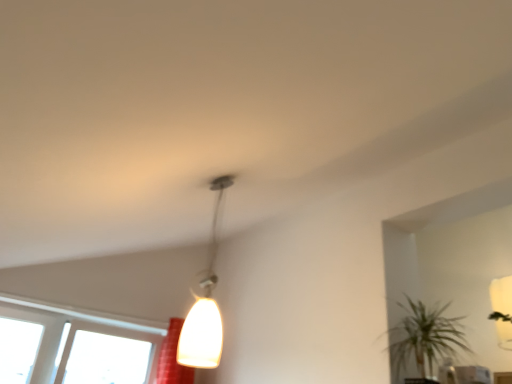
Question: Is transparent glass window at lower left to the right of white glossy pendant light at center from the viewer's perspective?

Choices:
 (A) no
 (B) yes

Answer: (A)

Question: Is transparent glass window at lower left closer to camera compared to white glossy pendant light at center?

Choices:
 (A) no
 (B) yes

Answer: (A)

Question: Can you confirm if transparent glass window at lower left is taller than white glossy pendant light at center?

Choices:
 (A) no
 (B) yes

Answer: (A)

Question: Is transparent glass window at lower left turned away from white glossy pendant light at center?

Choices:
 (A) yes
 (B) no

Answer: (B)

Question: Is transparent glass window at lower left thinner than white glossy pendant light at center?

Choices:
 (A) no
 (B) yes

Answer: (A)

Question: Is transparent glass window at lower left directly adjacent to white glossy pendant light at center?

Choices:
 (A) yes
 (B) no

Answer: (B)

Question: From the image's perspective, does green leafy plant at lower right appear higher than transparent glass window at lower left?

Choices:
 (A) yes
 (B) no

Answer: (A)

Question: Is the depth of green leafy plant at lower right greater than that of transparent glass window at lower left?

Choices:
 (A) yes
 (B) no

Answer: (B)

Question: Could you tell me if green leafy plant at lower right is turned towards transparent glass window at lower left?

Choices:
 (A) yes
 (B) no

Answer: (B)

Question: Considering the relative sizes of green leafy plant at lower right and transparent glass window at lower left in the image provided, is green leafy plant at lower right wider than transparent glass window at lower left?

Choices:
 (A) yes
 (B) no

Answer: (A)

Question: Is green leafy plant at lower right positioned beyond the bounds of transparent glass window at lower left?

Choices:
 (A) no
 (B) yes

Answer: (B)

Question: Can you confirm if green leafy plant at lower right is positioned to the left of transparent glass window at lower left?

Choices:
 (A) yes
 (B) no

Answer: (B)

Question: From a real-world perspective, is green leafy plant at lower right physically above white glossy pendant light at center?

Choices:
 (A) no
 (B) yes

Answer: (A)